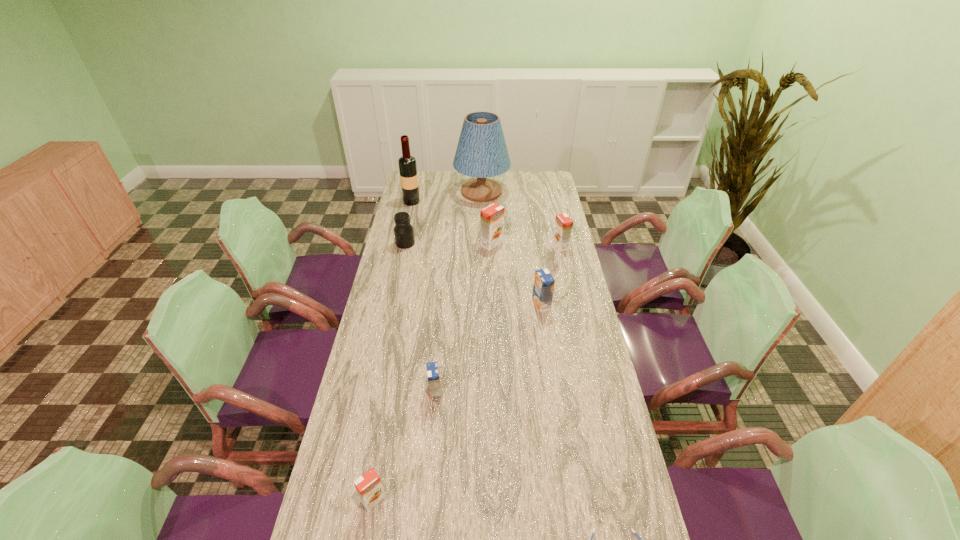
Where is `unoccupied area between the right blue orange_juice and the rightmost orange juice`? This screenshot has height=540, width=960. unoccupied area between the right blue orange_juice and the rightmost orange juice is located at coordinates coord(551,275).

The width and height of the screenshot is (960, 540). Find the location of `vacant space that is in between the fourth orange juice from left to right and the nearer blue orange_juice`. vacant space that is in between the fourth orange juice from left to right and the nearer blue orange_juice is located at coordinates (489, 348).

The width and height of the screenshot is (960, 540). Identify the location of free space between the lampshade and the rightmost orange orange juice. (521, 219).

At what (x,y) coordinates should I click in order to perform the action: click on vacant area between the jar and the second orange orange juice from right to left. Please return your answer as a coordinate pair (x, y). Image resolution: width=960 pixels, height=540 pixels. Looking at the image, I should click on (448, 244).

Identify the location of free point between the wine bottle and the lampshade. (446, 197).

You are a GUI agent. You are given a task and a screenshot of the screen. Output one action in this format:
    pyautogui.click(x=<x>, y=<y>)
    Task: Click on the seventh closest object to the seventh farthest object
    
    Given the screenshot: What is the action you would take?
    pyautogui.click(x=481, y=152)

Identify which object is the closest to the rightmost orange juice. Please provide its 2D coordinates. Your answer should be formatted as a tuple, i.e. [(x, y)], where the tuple contains the x and y coordinates of a point satisfying the conditions above.

[(491, 217)]

The width and height of the screenshot is (960, 540). I want to click on orange juice that is the third closest to the wine bottle, so click(543, 288).

You are a GUI agent. You are given a task and a screenshot of the screen. Output one action in this format:
    pyautogui.click(x=<x>, y=<y>)
    Task: Click on the orange juice that is the second nearest to the wine bottle
    
    Given the screenshot: What is the action you would take?
    pyautogui.click(x=563, y=223)

Select which orange orange juice appears as the closest to the wine bottle. Please provide its 2D coordinates. Your answer should be formatted as a tuple, i.e. [(x, y)], where the tuple contains the x and y coordinates of a point satisfying the conditions above.

[(491, 217)]